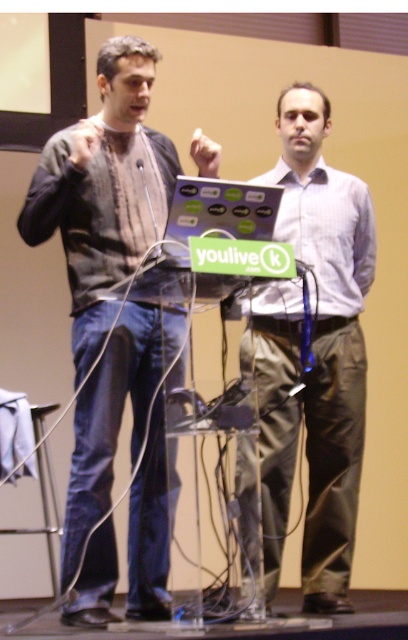
Question: Can you confirm if white glossy shirt at center is thinner than matte black laptop at center?

Choices:
 (A) no
 (B) yes

Answer: (A)

Question: Which object appears closest to the camera in this image?

Choices:
 (A) matte black laptop at center
 (B) matte gray sweater at left
 (C) white glossy shirt at center

Answer: (A)

Question: Estimate the real-world distances between objects in this image. Which object is farther from the matte black laptop at center?

Choices:
 (A) matte gray sweater at left
 (B) white glossy shirt at center

Answer: (B)

Question: Can you confirm if matte gray sweater at left is smaller than white glossy shirt at center?

Choices:
 (A) yes
 (B) no

Answer: (A)

Question: Is matte gray sweater at left positioned at the back of white glossy shirt at center?

Choices:
 (A) no
 (B) yes

Answer: (A)

Question: Which point appears farthest from the camera in this image?

Choices:
 (A) (161, 228)
 (B) (208, 216)

Answer: (A)